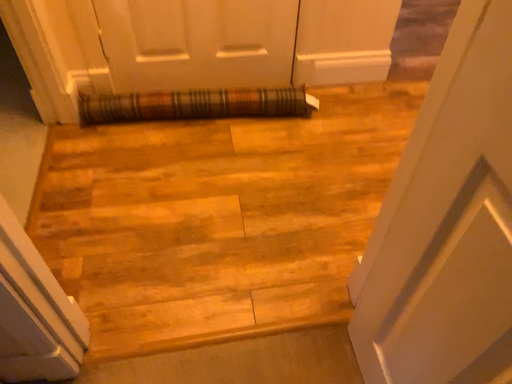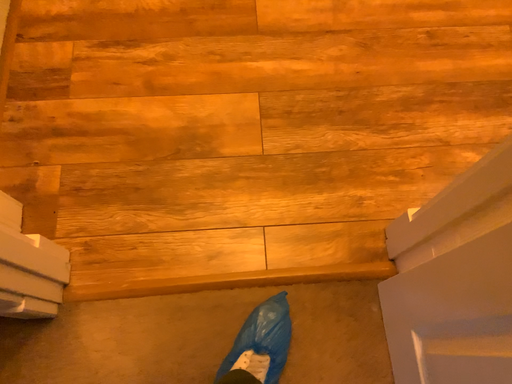
Question: Which way did the camera rotate in the video?

Choices:
 (A) rotated upward
 (B) rotated downward

Answer: (B)